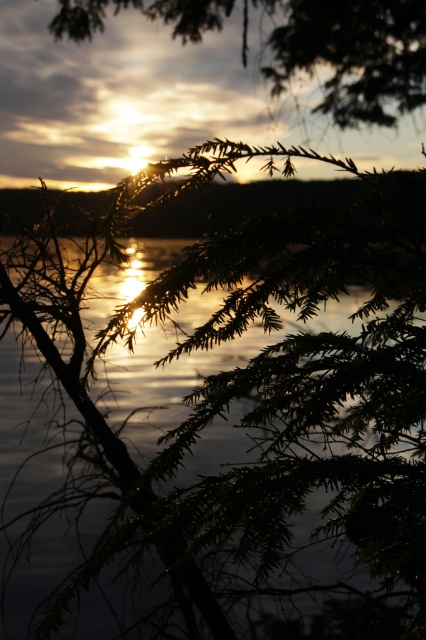
You are an artist trying to paint the sunset scene. You want to ensure the glistening reflective water at center and the silvery metallic branches at upper center are accurately placed. Based on the scene, which object is located above the other?

The silvery metallic branches at upper center are positioned above the glistening reflective water at center.

You are an artist trying to paint the sunset scene. You want to ensure that the glistening reflective water at center and the silvery metallic branches at upper center are positioned correctly. Based on the scene description, which object should appear closer to the viewer?

The glistening reflective water at center is in front of silvery metallic branches at upper center, so the glistening reflective water at center should appear closer to the viewer.